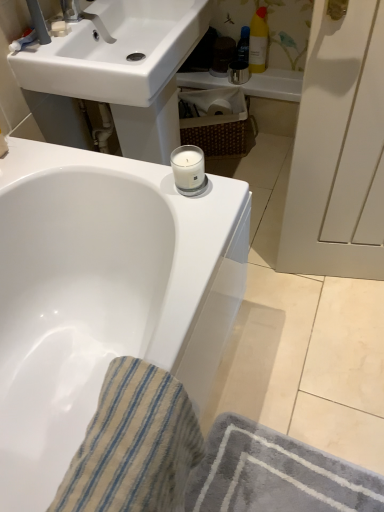
Question: Choose the correct answer: Is white glossy sink at upper center inside matte white faucet at upper left or outside it?

Choices:
 (A) inside
 (B) outside

Answer: (B)

Question: In terms of height, does white glossy sink at upper center look taller or shorter compared to matte white faucet at upper left?

Choices:
 (A) short
 (B) tall

Answer: (B)

Question: Which of these objects is positioned farthest from the translucent plastic bottle at upper right, positioned as the second toiletry in right-to-left order?

Choices:
 (A) white glossy bathtub at upper center
 (B) matte white faucet at upper left
 (C) beige striped cloth at lower left
 (D) woven brown basket at center
 (E) yellow matte bottle at upper right, which appears as the 1th toiletry when viewed from the right

Answer: (C)

Question: Based on their relative distances, which object is nearer to the woven brown basket at center?

Choices:
 (A) translucent plastic bottle at upper right, marked as the 1th toiletry in a left-to-right arrangement
 (B) matte white faucet at upper left
 (C) white glossy sink at upper center
 (D) yellow matte bottle at upper right, which ranks as the 2th toiletry in left-to-right order
 (E) beige striped cloth at lower left

Answer: (D)